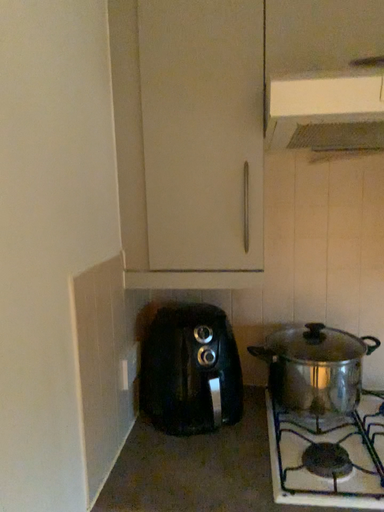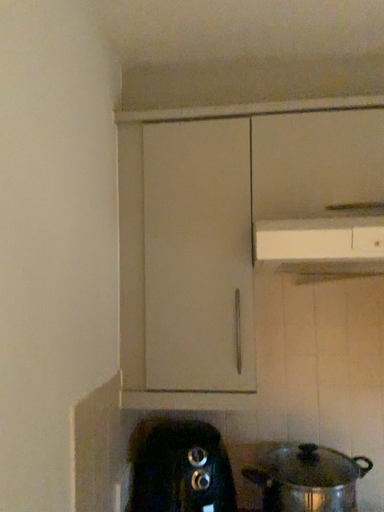
Question: How did the camera likely rotate when shooting the video?

Choices:
 (A) rotated downward
 (B) rotated upward

Answer: (B)